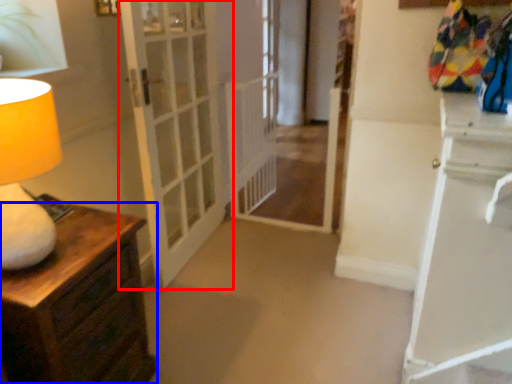
Question: Which of the following is the farthest to the observer, door (highlighted by a red box) or chest of drawers (highlighted by a blue box)?

Choices:
 (A) door
 (B) chest of drawers

Answer: (A)